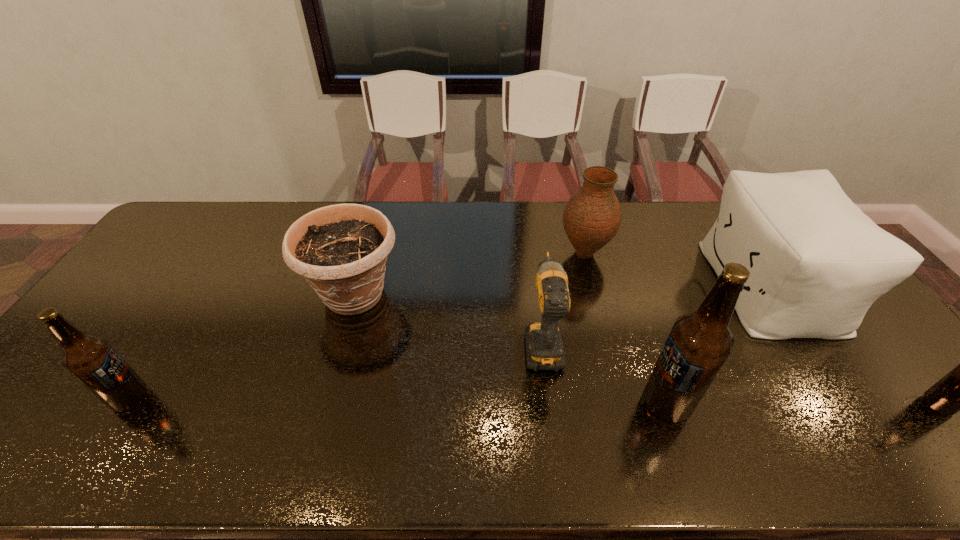
Image resolution: width=960 pixels, height=540 pixels. Identify the location of spot to insert another beer_bottle for uniform distribution. (397, 401).